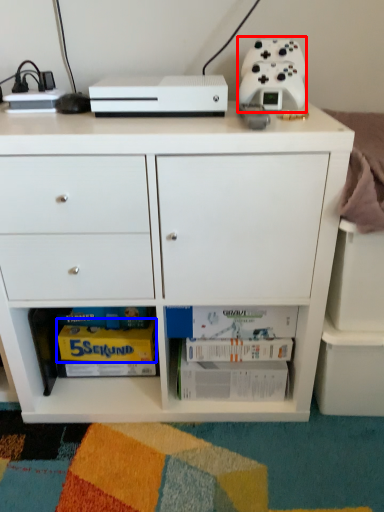
Question: Which of the following is the farthest to the observer, appliance (highlighted by a red box) or magazine (highlighted by a blue box)?

Choices:
 (A) appliance
 (B) magazine

Answer: (B)